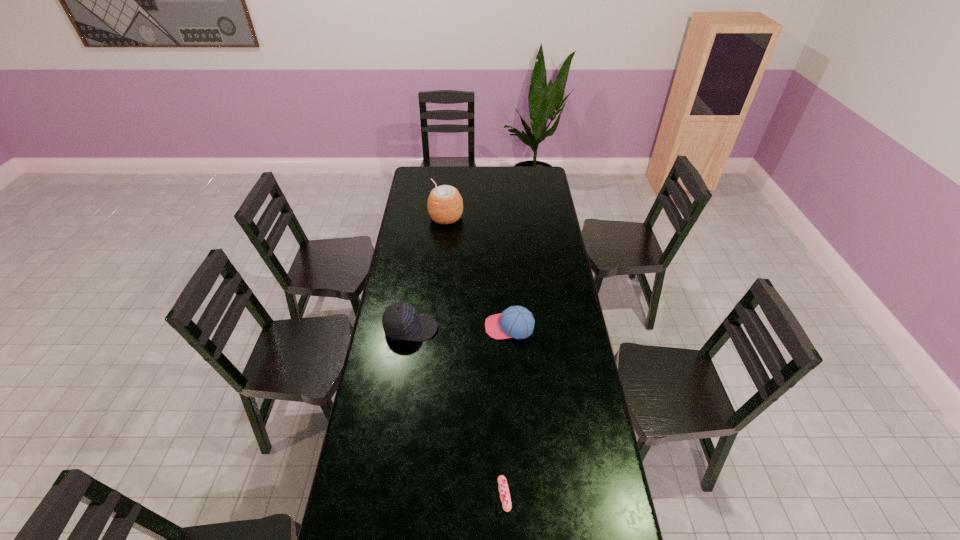
Find the location of a particular element. This screenshot has width=960, height=540. object that stands as the closest to the nearest object is located at coordinates (517, 322).

Find the location of a particular element. object that stands as the closest to the taller baseball cap is located at coordinates (517, 322).

Identify the location of vacant region that satisfies the following two spatial constraints: 1. on the back side of the shortest object; 2. at the front of the taller baseball cap where the brim is located. This screenshot has width=960, height=540. click(498, 329).

The height and width of the screenshot is (540, 960). I want to click on blank space that satisfies the following two spatial constraints: 1. at the front of the shortest object where the brim is located; 2. on the right side of the taller baseball cap, so click(387, 494).

Where is `blank area in the image that satisfies the following two spatial constraints: 1. on the front side of the shortest object; 2. on the left side of the coconut`? Image resolution: width=960 pixels, height=540 pixels. blank area in the image that satisfies the following two spatial constraints: 1. on the front side of the shortest object; 2. on the left side of the coconut is located at coordinates (420, 494).

You are a GUI agent. You are given a task and a screenshot of the screen. Output one action in this format:
    pyautogui.click(x=<x>, y=<y>)
    Task: Click on the vacant point that satisfies the following two spatial constraints: 1. on the front-facing side of the shorter baseball cap; 2. on the front side of the shortest object
    This screenshot has width=960, height=540.
    Given the screenshot: What is the action you would take?
    pyautogui.click(x=520, y=494)

At what (x,y) coordinates should I click in order to perform the action: click on vacant space that satisfies the following two spatial constraints: 1. at the front of the left baseball cap where the brim is located; 2. on the right side of the eclair. Please return your answer as a coordinate pair (x, y). This screenshot has width=960, height=540. Looking at the image, I should click on (387, 494).